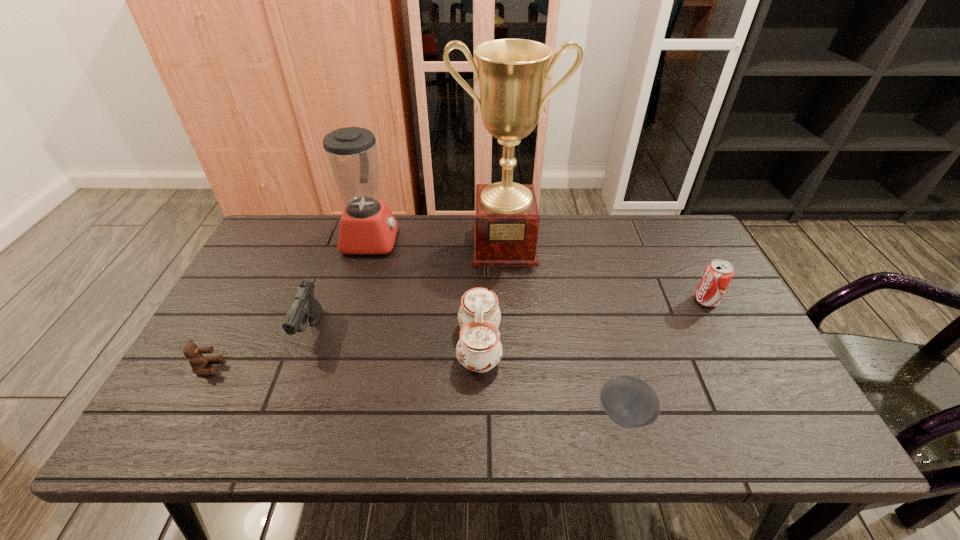
Find the location of a particular element. free space between the tallest object and the pistol is located at coordinates (407, 288).

Locate an element on the screen. vacant area that lies between the blender and the sixth tallest object is located at coordinates (289, 303).

Find the location of a particular element. Image resolution: width=960 pixels, height=540 pixels. vacant space that's between the pistol and the trophy cup is located at coordinates (407, 288).

At what (x,y) coordinates should I click in order to perform the action: click on object identified as the third closest to the trophy cup. Please return your answer as a coordinate pair (x, y). Looking at the image, I should click on (718, 273).

Select which object is the closest to the pistol. Please provide its 2D coordinates. Your answer should be formatted as a tuple, i.e. [(x, y)], where the tuple contains the x and y coordinates of a point satisfying the conditions above.

[(197, 361)]

You are a GUI agent. You are given a task and a screenshot of the screen. Output one action in this format:
    pyautogui.click(x=<x>, y=<y>)
    Task: Click on the blank space that satisfies the following two spatial constraints: 1. at the barrel of the pistol; 2. on the face of the leftmost object
    This screenshot has height=540, width=960.
    Given the screenshot: What is the action you would take?
    pyautogui.click(x=298, y=367)

You are a GUI agent. You are given a task and a screenshot of the screen. Output one action in this format:
    pyautogui.click(x=<x>, y=<y>)
    Task: Click on the vacant area that satisfies the following two spatial constraints: 1. on the back side of the nearest object; 2. on the face of the second shortest object
    
    Given the screenshot: What is the action you would take?
    pyautogui.click(x=612, y=367)

Identify the location of vacant space that satisfies the following two spatial constraints: 1. on the front side of the soda can; 2. on the face of the leftmost object. (741, 367).

This screenshot has width=960, height=540. I want to click on vacant area in the image that satisfies the following two spatial constraints: 1. at the barrel of the pistol; 2. on the face of the leftmost object, so 298,367.

Find the location of a particular element. vacant area in the image that satisfies the following two spatial constraints: 1. on the front of the second tallest object near the controls; 2. on the left side of the sixth object from left to right is located at coordinates (320, 414).